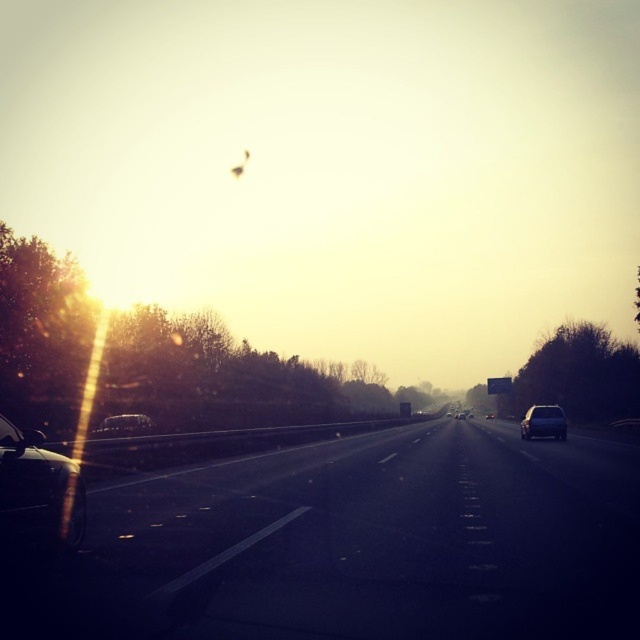
Between black asphalt highway at center and satin black sedan at right, which one appears on the right side from the viewer's perspective?

satin black sedan at right is more to the right.

Who is more forward, (88, 625) or (541, 422)?

Point (88, 625) is more forward.

Is point (250, 566) closer to camera compared to point (554, 435)?

Yes, point (250, 566) is closer to viewer.

In order to click on black asphalt highway at center in this screenshot , I will do click(356, 545).

Who is positioned more to the right, shiny metallic car at left or satin black car at left?

shiny metallic car at left

Measure the distance from shiny metallic car at left to satin black car at left.

The distance of shiny metallic car at left from satin black car at left is 49.86 feet.

Image resolution: width=640 pixels, height=640 pixels. What do you see at coordinates (38, 490) in the screenshot? I see `shiny metallic car at left` at bounding box center [38, 490].

You are a GUI agent. You are given a task and a screenshot of the screen. Output one action in this format:
    pyautogui.click(x=<x>, y=<y>)
    Task: Click on the shiny metallic car at left
    The width and height of the screenshot is (640, 640).
    Given the screenshot: What is the action you would take?
    pyautogui.click(x=38, y=490)

Does point (129, 412) lie behind point (460, 412)?

No, (129, 412) is closer to viewer.

Does satin black car at left have a smaller size compared to satin silver sedan at center?

Yes.

Where is `satin black car at left`? satin black car at left is located at coordinates (124, 424).